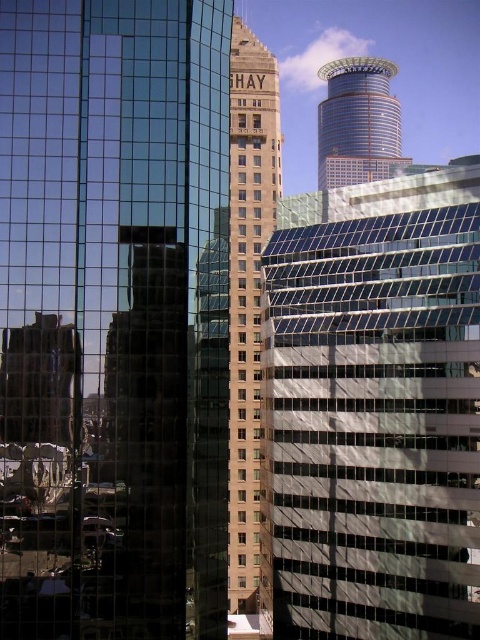
Which is behind, point (86, 4) or point (256, 374)?

The point (256, 374) is behind.

Is point (106, 45) closer to camera compared to point (228, 461)?

Yes, point (106, 45) is in front of point (228, 461).

Does point (215, 131) come farther from viewer compared to point (263, 170)?

No.

Find the location of `reflective glass skyscraper at left`. reflective glass skyscraper at left is located at coordinates (117, 307).

This screenshot has height=640, width=480. Describe the element at coordinates (372, 412) in the screenshot. I see `glassy reflective building at center` at that location.

Identify the location of glassy reflective building at center. This screenshot has height=640, width=480. (372, 412).

Find the location of a particular element. This screenshot has width=480, height=640. beige stone building at center is located at coordinates (249, 307).

Between beige stone building at center and shiny glass tower at upper center, which one is positioned lower?

beige stone building at center is below.

You are a GUI agent. You are given a task and a screenshot of the screen. Output one action in this format:
    pyautogui.click(x=<x>, y=<y>)
    Task: Click on the beige stone building at center
    This screenshot has height=640, width=480.
    Given the screenshot: What is the action you would take?
    pyautogui.click(x=249, y=307)

Locate an element on the screen. The image size is (480, 640). beige stone building at center is located at coordinates (249, 307).